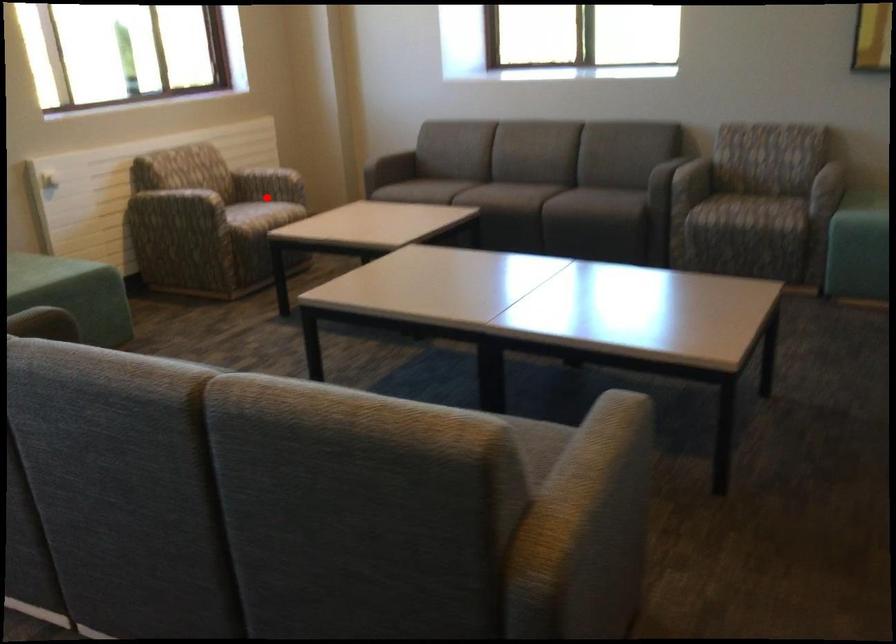
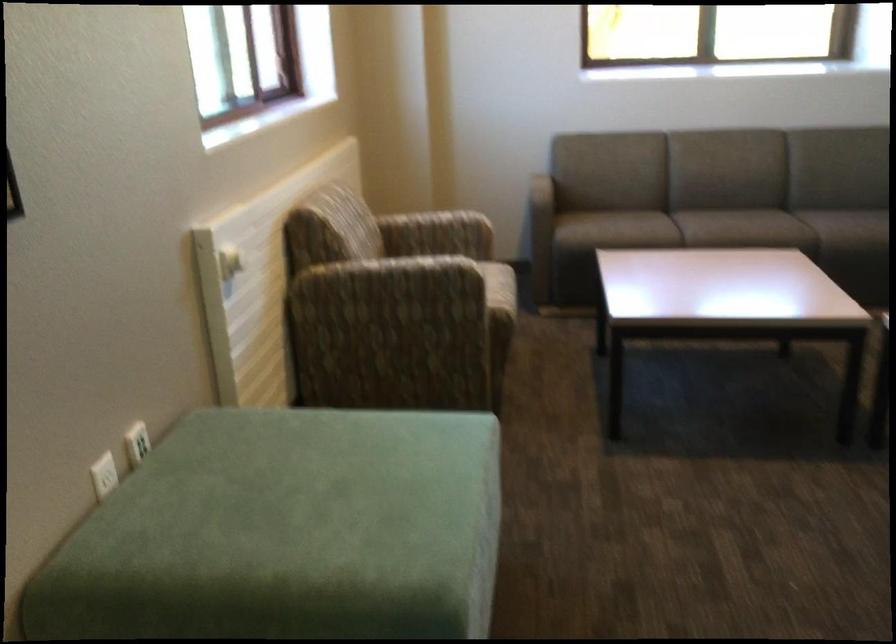
Question: I am providing you with two images of the same scene from different viewpoints. In image1, a red point is highlighted. Considering the same 3D point in image2, which of the following is correct?

Choices:
 (A) It is closer
 (B) It is farther

Answer: (A)